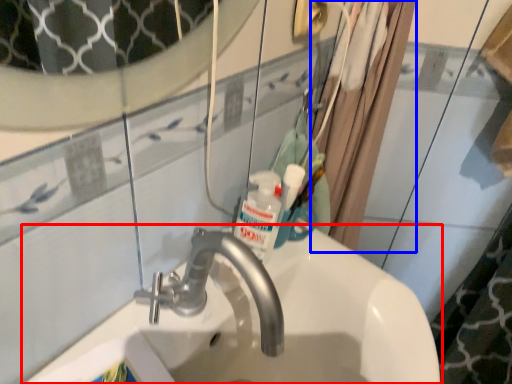
Question: Which point is further to the camera, sink (highlighted by a red box) or shower curtain (highlighted by a blue box)?

Choices:
 (A) sink
 (B) shower curtain

Answer: (B)